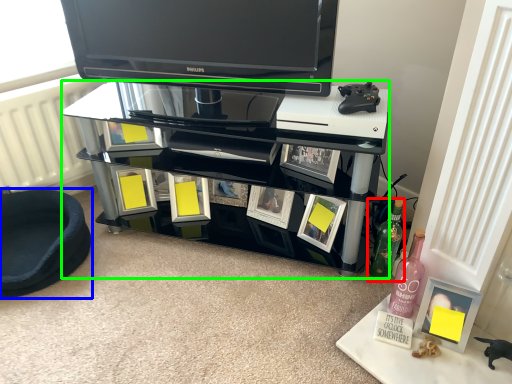
Question: Which is nearer to the bottle (highlighted by a red box)? furniture (highlighted by a blue box) or shelf (highlighted by a green box).

Choices:
 (A) furniture
 (B) shelf

Answer: (B)